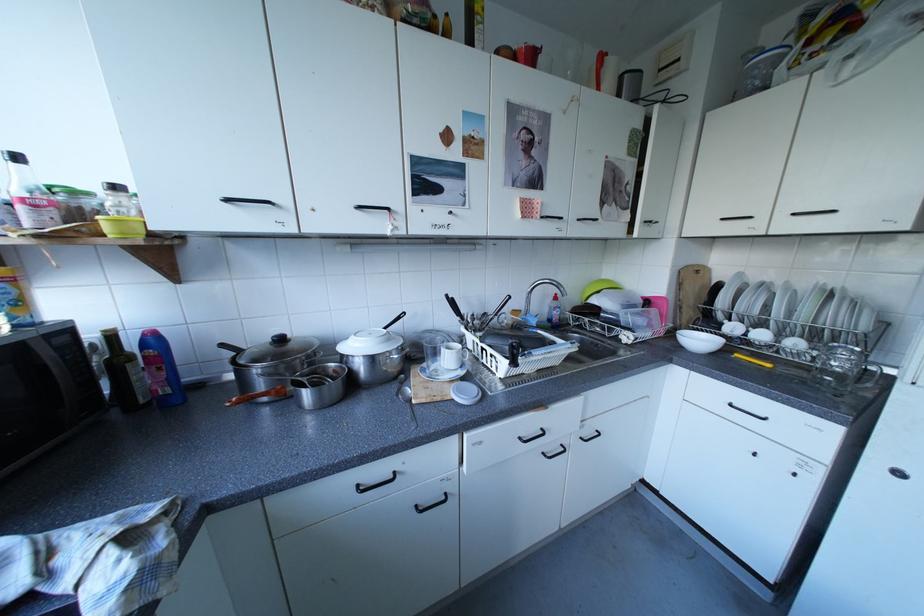
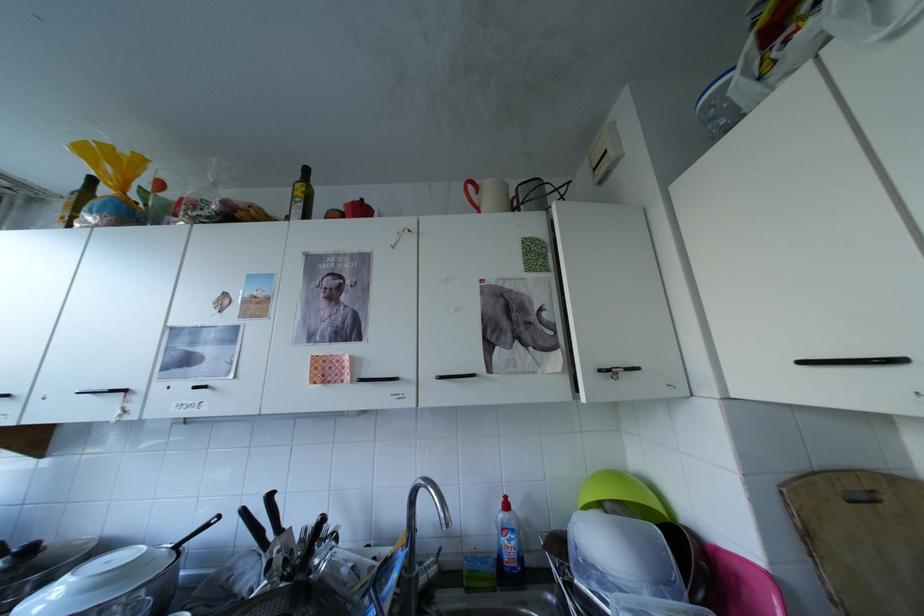
Locate, in the second image, the point that corresponds to the point at 566,312 in the first image.

(517, 541)